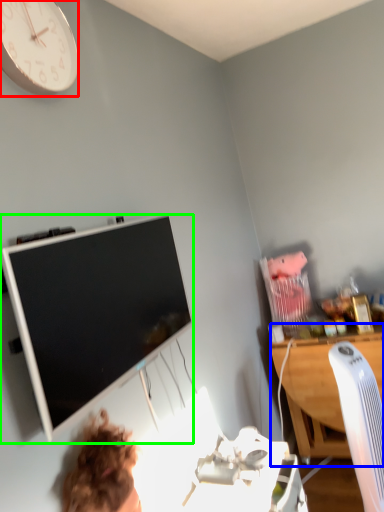
Question: Considering the real-world distances, which object is farthest from wall clock (highlighted by a red box)? desk (highlighted by a blue box) or television (highlighted by a green box)?

Choices:
 (A) desk
 (B) television

Answer: (A)